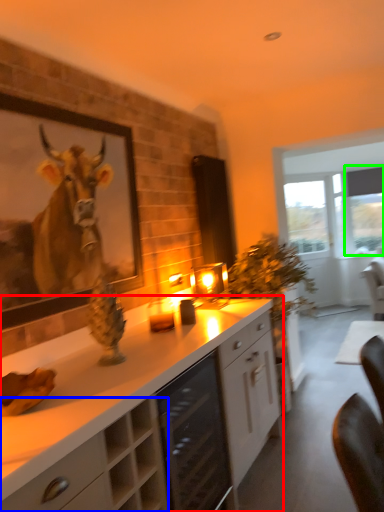
Question: Which object is positioned farthest from cabinetry (highlighted by a red box)? Select from cabinetry (highlighted by a blue box) and window screen (highlighted by a green box).

Choices:
 (A) cabinetry
 (B) window screen

Answer: (B)